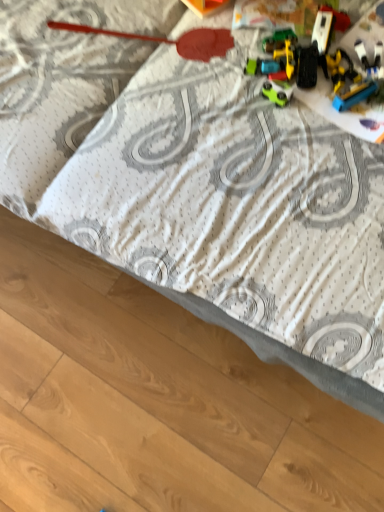
Where is `yellow plastic toy truck at upper right, which is the first toy in right-to-left order`? Image resolution: width=384 pixels, height=512 pixels. yellow plastic toy truck at upper right, which is the first toy in right-to-left order is located at coordinates (354, 75).

Describe the element at coordinates (338, 52) in the screenshot. The height and width of the screenshot is (512, 384). I see `multicolored plastic toy cars at upper right, acting as the second toy starting from the right` at that location.

What do you see at coordinates (277, 92) in the screenshot? The width and height of the screenshot is (384, 512). I see `green matte car at center, the second toy positioned from the left` at bounding box center [277, 92].

You are a GUI agent. You are given a task and a screenshot of the screen. Output one action in this format:
    pyautogui.click(x=<x>, y=<y>)
    Task: Click on the yellow plastic toy truck at upper right, which is counted as the 4th toy, starting from the left
    
    Given the screenshot: What is the action you would take?
    pyautogui.click(x=354, y=75)

What's the angular difference between green matte car at center, placed as the third toy when sorted from right to left, and multicolored plastic toy cars at upper right, acting as the second toy starting from the right,'s facing directions?

The facing directions of green matte car at center, placed as the third toy when sorted from right to left, and multicolored plastic toy cars at upper right, acting as the second toy starting from the right, are 95 degrees apart.

From a real-world perspective, which object rests below the other?

From a 3D spatial view, multicolored plastic toy cars at upper right, acting as the second toy starting from the right, is below.

Does green matte car at center, the second toy positioned from the left, turn towards multicolored plastic toy cars at upper right, positioned as the 3th toy in left-to-right order?

No, green matte car at center, the second toy positioned from the left, is not turned towards multicolored plastic toy cars at upper right, positioned as the 3th toy in left-to-right order.

From a real-world perspective, count 2nd toys downward from the green matte car at center, the second toy positioned from the left, and point to it. Please provide its 2D coordinates.

[(354, 75)]

Can you confirm if green matte car at center, the second toy positioned from the left, is smaller than yellow plastic toy truck at upper right, which is the first toy in right-to-left order?

Correct, green matte car at center, the second toy positioned from the left, occupies less space than yellow plastic toy truck at upper right, which is the first toy in right-to-left order.

From a real-world perspective, is green matte car at center, placed as the third toy when sorted from right to left, positioned above or below yellow plastic toy truck at upper right, which is counted as the 4th toy, starting from the left?

Clearly, from a real-world perspective, green matte car at center, placed as the third toy when sorted from right to left, is above yellow plastic toy truck at upper right, which is counted as the 4th toy, starting from the left.

Is green matte car at center, the second toy positioned from the left, situated inside yellow plastic toy truck at upper right, which is counted as the 4th toy, starting from the left, or outside?

green matte car at center, the second toy positioned from the left, is outside yellow plastic toy truck at upper right, which is counted as the 4th toy, starting from the left.

Is point (359, 42) behind point (274, 93)?

Yes, point (359, 42) is behind point (274, 93).

Who is taller, yellow plastic toy truck at upper right, which is counted as the 4th toy, starting from the left, or green matte car at center, the second toy positioned from the left?

Standing taller between the two is yellow plastic toy truck at upper right, which is counted as the 4th toy, starting from the left.

From a real-world perspective, is yellow plastic toy truck at upper right, which is the first toy in right-to-left order, positioned under green matte car at center, placed as the third toy when sorted from right to left, based on gravity?

Correct, in the physical world, yellow plastic toy truck at upper right, which is the first toy in right-to-left order, is lower than green matte car at center, placed as the third toy when sorted from right to left.

Could you tell me if yellow plastic toy truck at upper right, which is the first toy in right-to-left order, is turned towards green matte car at center, placed as the third toy when sorted from right to left?

Yes, yellow plastic toy truck at upper right, which is the first toy in right-to-left order, is oriented towards green matte car at center, placed as the third toy when sorted from right to left.

In the image, is multicolored plastic toy cars at upper right, acting as the second toy starting from the right, positioned in front of or behind green matte car at center, the second toy positioned from the left?

Clearly, multicolored plastic toy cars at upper right, acting as the second toy starting from the right, is in front of green matte car at center, the second toy positioned from the left.

From the image's perspective, between multicolored plastic toy cars at upper right, acting as the second toy starting from the right, and green matte car at center, placed as the third toy when sorted from right to left, which one is located above?

From the image's view, multicolored plastic toy cars at upper right, acting as the second toy starting from the right, is above.

Can you tell me how much multicolored plastic toy cars at upper right, positioned as the 3th toy in left-to-right order, and green matte car at center, the second toy positioned from the left, differ in facing direction?

The angular difference between multicolored plastic toy cars at upper right, positioned as the 3th toy in left-to-right order, and green matte car at center, the second toy positioned from the left, is 95 degrees.

Considering the relative sizes of multicolored plastic toy cars at upper right, acting as the second toy starting from the right, and green matte car at center, placed as the third toy when sorted from right to left, in the image provided, is multicolored plastic toy cars at upper right, acting as the second toy starting from the right, taller than green matte car at center, placed as the third toy when sorted from right to left,?

Indeed, multicolored plastic toy cars at upper right, acting as the second toy starting from the right, has a greater height compared to green matte car at center, placed as the third toy when sorted from right to left.

Which is correct: multicolored plastic toy cars at upper right, acting as the second toy starting from the right, is inside metallic red spatula at upper center, positioned as the 1th toy in left-to-right order, or outside of it?

multicolored plastic toy cars at upper right, acting as the second toy starting from the right, is outside metallic red spatula at upper center, positioned as the 1th toy in left-to-right order.

Consider the image. Could you tell me if multicolored plastic toy cars at upper right, positioned as the 3th toy in left-to-right order, is turned towards metallic red spatula at upper center, positioned as the 1th toy in left-to-right order?

No, multicolored plastic toy cars at upper right, positioned as the 3th toy in left-to-right order, does not turn towards metallic red spatula at upper center, positioned as the 1th toy in left-to-right order.

From the multicolored plastic toy cars at upper right, acting as the second toy starting from the right, count the 2nd toy to the left and point to it. Please provide its 2D coordinates.

[(170, 40)]

Who is shorter, multicolored plastic toy cars at upper right, positioned as the 3th toy in left-to-right order, or metallic red spatula at upper center, the 4th toy when ordered from right to left?

metallic red spatula at upper center, the 4th toy when ordered from right to left, is shorter.

The width and height of the screenshot is (384, 512). In order to click on toy that is the 1st one when counting forward from the metallic red spatula at upper center, positioned as the 1th toy in left-to-right order in this screenshot , I will do `click(277, 92)`.

Would you say green matte car at center, placed as the third toy when sorted from right to left, is inside or outside metallic red spatula at upper center, the 4th toy when ordered from right to left?

green matte car at center, placed as the third toy when sorted from right to left, is not inside metallic red spatula at upper center, the 4th toy when ordered from right to left, it's outside.

How many degrees apart are the facing directions of green matte car at center, placed as the third toy when sorted from right to left, and metallic red spatula at upper center, the 4th toy when ordered from right to left?

110 degrees separate the facing orientations of green matte car at center, placed as the third toy when sorted from right to left, and metallic red spatula at upper center, the 4th toy when ordered from right to left.

Which object is wider, green matte car at center, placed as the third toy when sorted from right to left, or metallic red spatula at upper center, positioned as the 1th toy in left-to-right order?

metallic red spatula at upper center, positioned as the 1th toy in left-to-right order.

Would you say yellow plastic toy truck at upper right, which is counted as the 4th toy, starting from the left, contains multicolored plastic toy cars at upper right, acting as the second toy starting from the right?

No, multicolored plastic toy cars at upper right, acting as the second toy starting from the right, is not a part of yellow plastic toy truck at upper right, which is counted as the 4th toy, starting from the left.

Does yellow plastic toy truck at upper right, which is the first toy in right-to-left order, have a greater width compared to multicolored plastic toy cars at upper right, positioned as the 3th toy in left-to-right order?

Correct, the width of yellow plastic toy truck at upper right, which is the first toy in right-to-left order, exceeds that of multicolored plastic toy cars at upper right, positioned as the 3th toy in left-to-right order.

Which is less distant, (369, 92) or (259, 9)?

Point (369, 92) is closer to the camera than point (259, 9).

The image size is (384, 512). Identify the location of the 2nd toy above when counting from the green matte car at center, placed as the third toy when sorted from right to left (from the image's perspective). (338, 52).

You are a GUI agent. You are given a task and a screenshot of the screen. Output one action in this format:
    pyautogui.click(x=<x>, y=<y>)
    Task: Click on the toy that is the 2nd object to the left of the yellow plastic toy truck at upper right, which is counted as the 4th toy, starting from the left, starting at the anchor
    
    Given the screenshot: What is the action you would take?
    click(277, 92)

Which object lies further to the anchor point metallic red spatula at upper center, positioned as the 1th toy in left-to-right order, green matte car at center, the second toy positioned from the left, or multicolored plastic toy cars at upper right, positioned as the 3th toy in left-to-right order?

Based on the image, green matte car at center, the second toy positioned from the left, appears to be further to metallic red spatula at upper center, positioned as the 1th toy in left-to-right order.

When comparing their distances from metallic red spatula at upper center, the 4th toy when ordered from right to left, does yellow plastic toy truck at upper right, which is counted as the 4th toy, starting from the left, or multicolored plastic toy cars at upper right, positioned as the 3th toy in left-to-right order, seem closer?

The object closer to metallic red spatula at upper center, the 4th toy when ordered from right to left, is multicolored plastic toy cars at upper right, positioned as the 3th toy in left-to-right order.

Which object lies nearer to the anchor point green matte car at center, placed as the third toy when sorted from right to left, metallic red spatula at upper center, the 4th toy when ordered from right to left, or multicolored plastic toy cars at upper right, positioned as the 3th toy in left-to-right order?

multicolored plastic toy cars at upper right, positioned as the 3th toy in left-to-right order, is closer to green matte car at center, placed as the third toy when sorted from right to left.

Based on their spatial positions, is metallic red spatula at upper center, the 4th toy when ordered from right to left, or yellow plastic toy truck at upper right, which is counted as the 4th toy, starting from the left, further from green matte car at center, placed as the third toy when sorted from right to left?

metallic red spatula at upper center, the 4th toy when ordered from right to left.

Which object lies further to the anchor point yellow plastic toy truck at upper right, which is counted as the 4th toy, starting from the left, multicolored plastic toy cars at upper right, acting as the second toy starting from the right, or metallic red spatula at upper center, positioned as the 1th toy in left-to-right order?

Based on the image, metallic red spatula at upper center, positioned as the 1th toy in left-to-right order, appears to be further to yellow plastic toy truck at upper right, which is counted as the 4th toy, starting from the left.

Looking at the image, which one is located further to metallic red spatula at upper center, the 4th toy when ordered from right to left, yellow plastic toy truck at upper right, which is counted as the 4th toy, starting from the left, or green matte car at center, the second toy positioned from the left?

yellow plastic toy truck at upper right, which is counted as the 4th toy, starting from the left, is further to metallic red spatula at upper center, the 4th toy when ordered from right to left.

From the image, which object appears to be nearer to multicolored plastic toy cars at upper right, positioned as the 3th toy in left-to-right order, metallic red spatula at upper center, positioned as the 1th toy in left-to-right order, or green matte car at center, placed as the third toy when sorted from right to left?

Based on the image, green matte car at center, placed as the third toy when sorted from right to left, appears to be nearer to multicolored plastic toy cars at upper right, positioned as the 3th toy in left-to-right order.

From the image, which object appears to be nearer to green matte car at center, the second toy positioned from the left, multicolored plastic toy cars at upper right, positioned as the 3th toy in left-to-right order, or yellow plastic toy truck at upper right, which is counted as the 4th toy, starting from the left?

yellow plastic toy truck at upper right, which is counted as the 4th toy, starting from the left, is closer to green matte car at center, the second toy positioned from the left.

Find the location of a particular element. The height and width of the screenshot is (512, 384). toy located between green matte car at center, placed as the third toy when sorted from right to left, and yellow plastic toy truck at upper right, which is counted as the 4th toy, starting from the left, in the left-right direction is located at coordinates (338, 52).

This screenshot has height=512, width=384. I want to click on toy located between metallic red spatula at upper center, positioned as the 1th toy in left-to-right order, and multicolored plastic toy cars at upper right, acting as the second toy starting from the right, in the left-right direction, so click(277, 92).